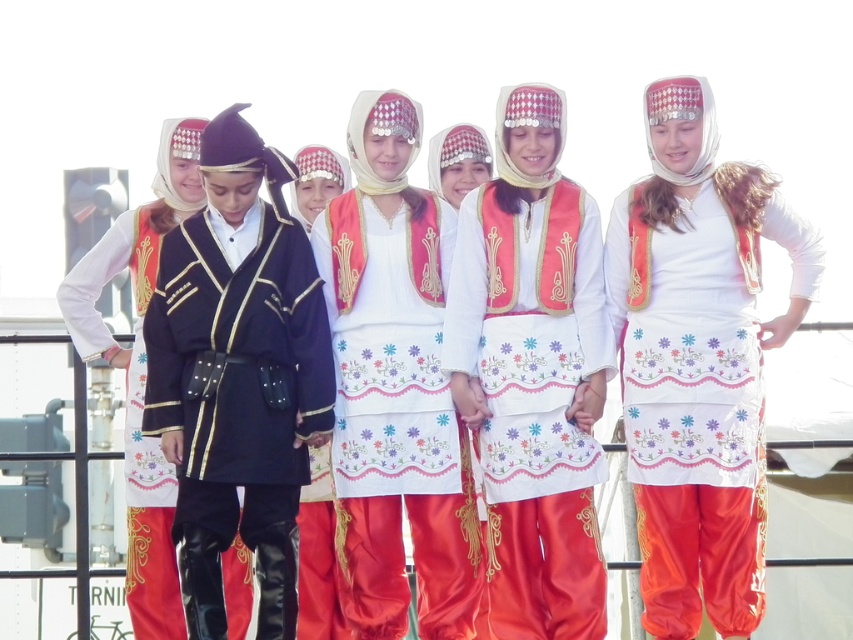
You are a photographer trying to capture a group photo of the scene. The white satin skirt at center and the embroidered silk dress at center are both in the frame. Which one will appear larger in the photo?

The white satin skirt at center will appear larger in the photo because it is much taller than the embroidered silk dress at center.

You are a photographer trying to capture a group photo of the white satin dress at center and the matte black vest at left. The minimum distance required for your camera to focus properly is 30 feet. Can you take a clear photo of both subjects without moving them?

The white satin dress at center and the matte black vest at left are 33.21 feet apart from each other, which exceeds the minimum 30 feet requirement. Therefore, you can take a clear photo of both subjects without moving them.